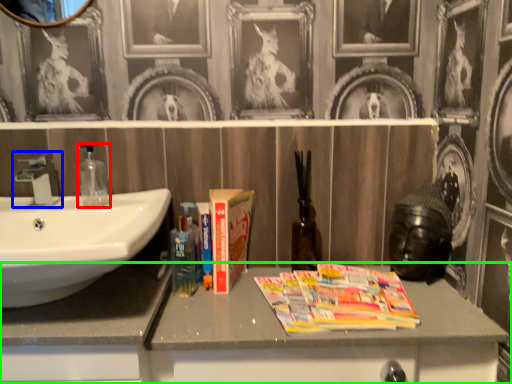
Question: Considering the real-world distances, which object is farthest from soap dispenser (highlighted by a red box)? tap (highlighted by a blue box) or bathroom cabinet (highlighted by a green box)?

Choices:
 (A) tap
 (B) bathroom cabinet

Answer: (B)